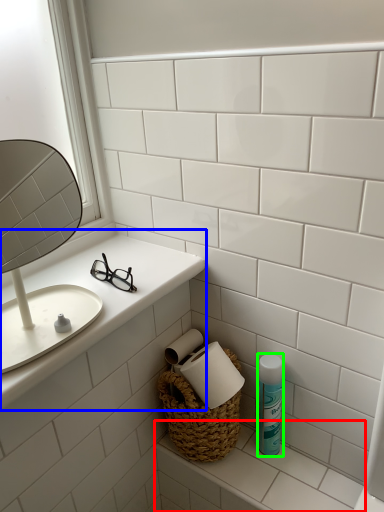
Question: Which object is positioned farthest from counter top (highlighted by a red box)? Select from counter top (highlighted by a blue box) and mouthwash (highlighted by a green box).

Choices:
 (A) counter top
 (B) mouthwash

Answer: (A)